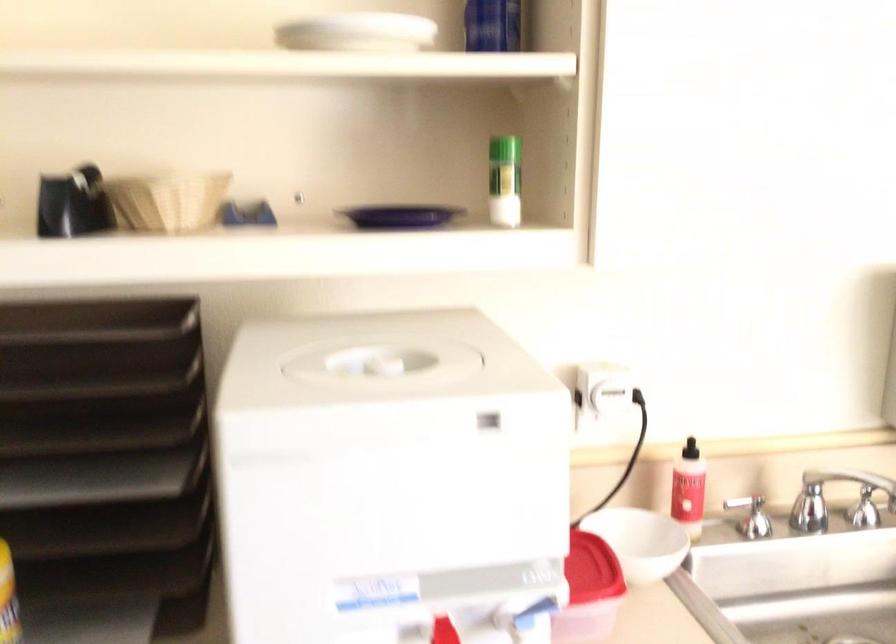
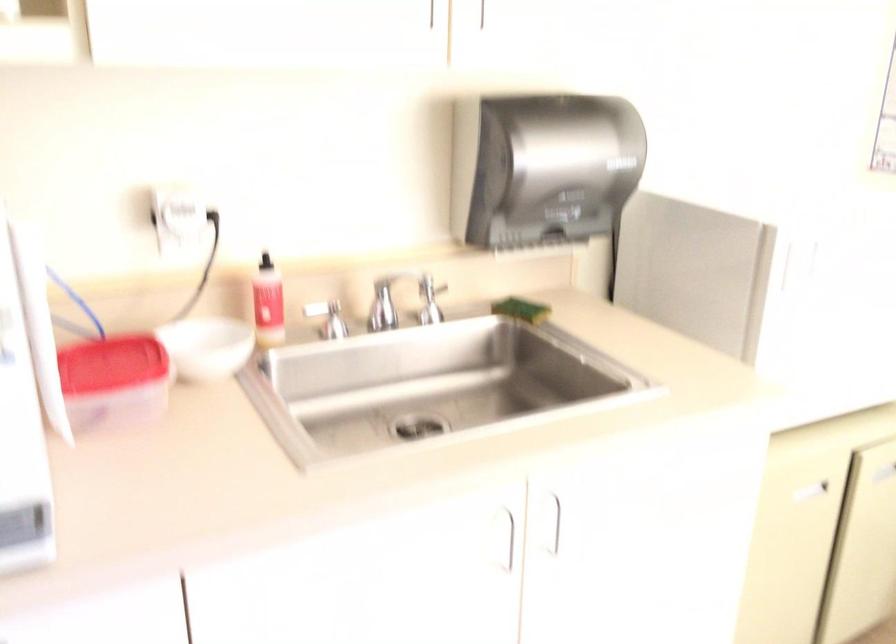
In a continuous first-person perspective shot, in which direction is the camera moving?

The cameraman walked toward right, backward.